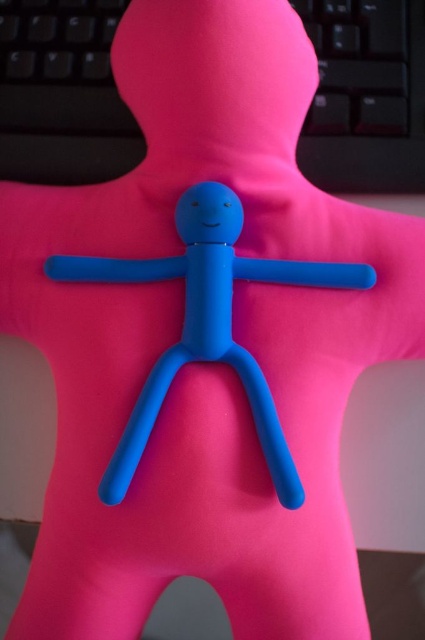
Question: Can you confirm if black plastic keyboard at upper center is positioned to the right of matte blue stick figure at center?

Choices:
 (A) no
 (B) yes

Answer: (B)

Question: Does black plastic keyboard at upper center have a lesser width compared to matte blue stick figure at center?

Choices:
 (A) yes
 (B) no

Answer: (A)

Question: Observing the image, what is the correct spatial positioning of black plastic keyboard at upper center in reference to matte blue stick figure at center?

Choices:
 (A) below
 (B) above

Answer: (B)

Question: Which point appears farthest from the camera in this image?

Choices:
 (A) (343, 141)
 (B) (189, 355)

Answer: (A)

Question: Among these points, which one is nearest to the camera?

Choices:
 (A) (124, 128)
 (B) (136, 456)

Answer: (B)